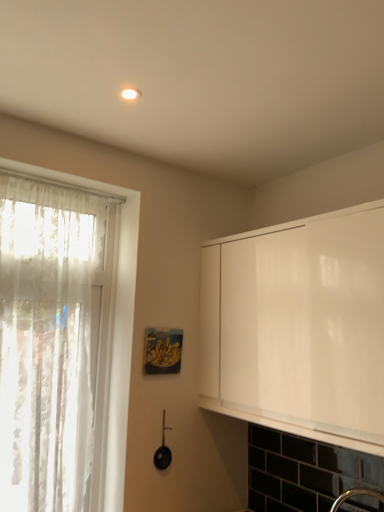
Question: Is white matte cabinet at right located within white lace curtain at left?

Choices:
 (A) yes
 (B) no

Answer: (B)

Question: Would you say white lace curtain at left is outside white matte cabinet at right?

Choices:
 (A) yes
 (B) no

Answer: (A)

Question: From the image's perspective, would you say white lace curtain at left is shown under white matte cabinet at right?

Choices:
 (A) no
 (B) yes

Answer: (B)

Question: Is white lace curtain at left facing away from white matte cabinet at right?

Choices:
 (A) no
 (B) yes

Answer: (A)

Question: Does white lace curtain at left have a lesser height compared to white matte cabinet at right?

Choices:
 (A) no
 (B) yes

Answer: (A)

Question: Is white lace curtain at left bigger than white matte cabinet at right?

Choices:
 (A) yes
 (B) no

Answer: (B)

Question: Considering the relative sizes of white matte cabinet at right and matte wooden picture frame at center in the image provided, is white matte cabinet at right wider than matte wooden picture frame at center?

Choices:
 (A) no
 (B) yes

Answer: (B)

Question: Is white matte cabinet at right placed right next to matte wooden picture frame at center?

Choices:
 (A) no
 (B) yes

Answer: (A)

Question: From the image's perspective, is white matte cabinet at right beneath matte wooden picture frame at center?

Choices:
 (A) no
 (B) yes

Answer: (A)

Question: From the image's perspective, is white matte cabinet at right located above matte wooden picture frame at center?

Choices:
 (A) no
 (B) yes

Answer: (B)

Question: Is white matte cabinet at right at the left side of matte wooden picture frame at center?

Choices:
 (A) no
 (B) yes

Answer: (A)

Question: Is white matte cabinet at right smaller than matte wooden picture frame at center?

Choices:
 (A) no
 (B) yes

Answer: (A)

Question: Can you confirm if white matte cabinet at right is shorter than white lace curtain at left?

Choices:
 (A) yes
 (B) no

Answer: (A)